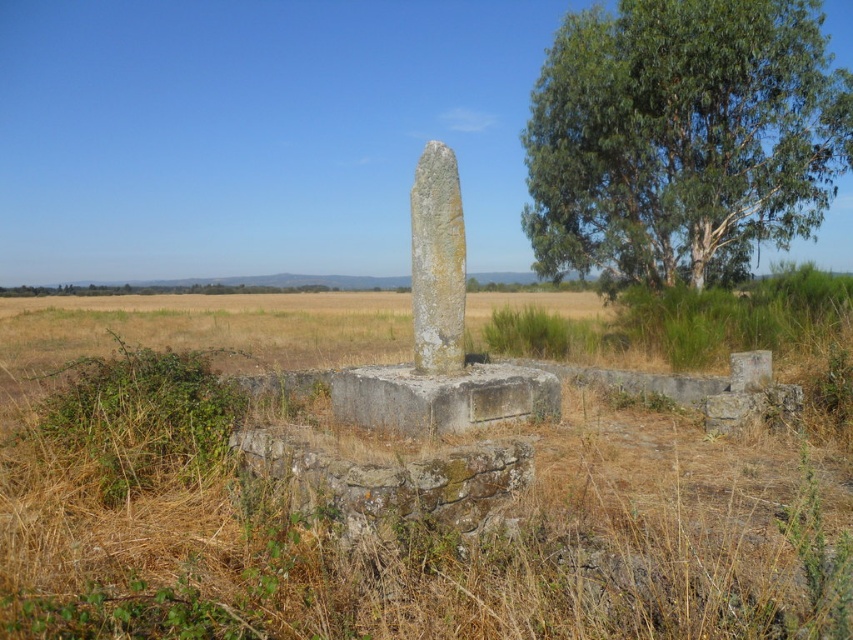
You are a farmer planning to plant a row of crops between the green leafy tree at upper right and the gray stone pillar at center. Which object has a wider base to determine where to start planting?

The green leafy tree at upper right has a wider base than the gray stone pillar at center, so you should start planting closer to the gray stone pillar at center to avoid the tree.

You are a farmer assessing the space between your crops and the gray stone monument at center and gray stone pillar at center. Which object takes up more area in the field?

The gray stone pillar at center occupies more space than the gray stone monument at center.

You are a hiker standing at the base of the green leafy tree at upper right and want to reach the gray stone monument at center. Which direction should you walk to get closer to the monument?

You should walk away from the green leafy tree at upper right towards the gray stone monument at center because the tree is closer to you than the monument, so moving away from the tree would bring you closer to the monument.